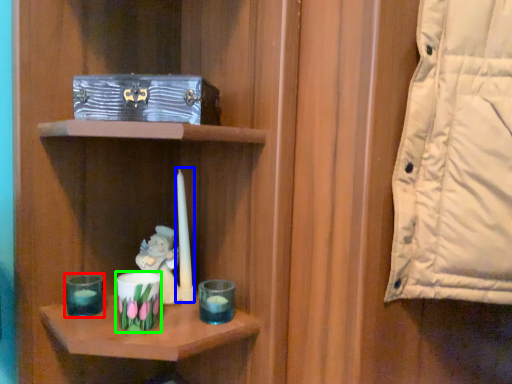
Question: Considering the real-world distances, which object is closest to candle holder (highlighted by a red box)? birthday candle (highlighted by a blue box) or candle holder (highlighted by a green box).

Choices:
 (A) birthday candle
 (B) candle holder

Answer: (B)